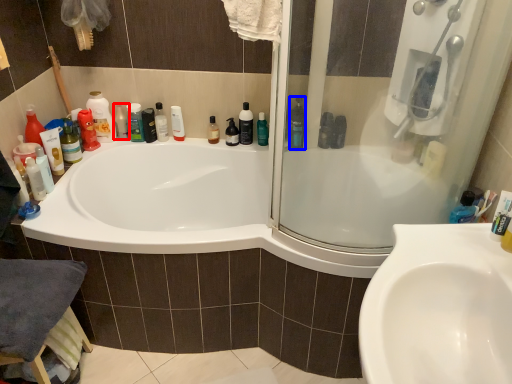
Question: Among these objects, which one is nearest to the camera, toiletry (highlighted by a red box) or cleaning product (highlighted by a blue box)?

Choices:
 (A) toiletry
 (B) cleaning product

Answer: (B)